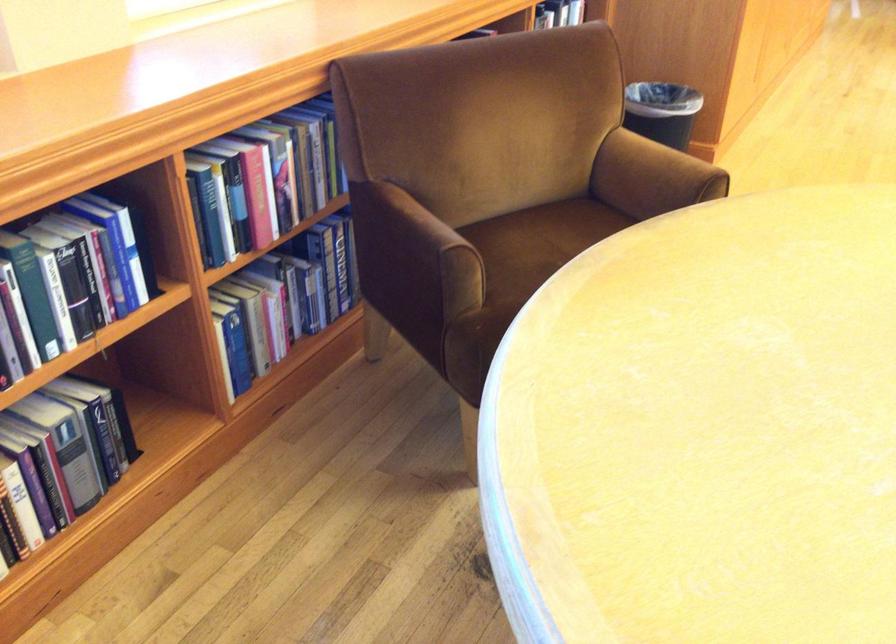
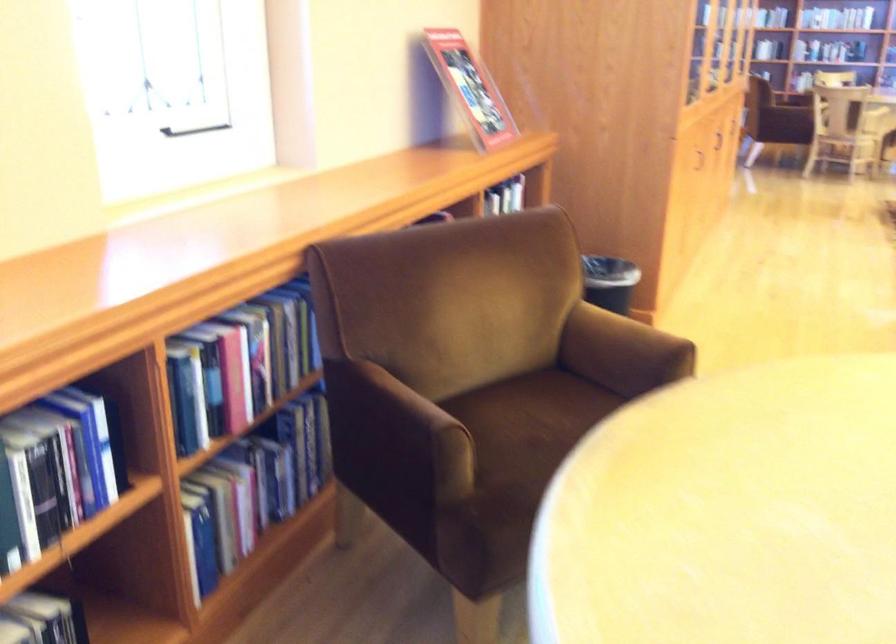
In the second image, find the point that corresponds to pixel 650 178 in the first image.

(622, 352)